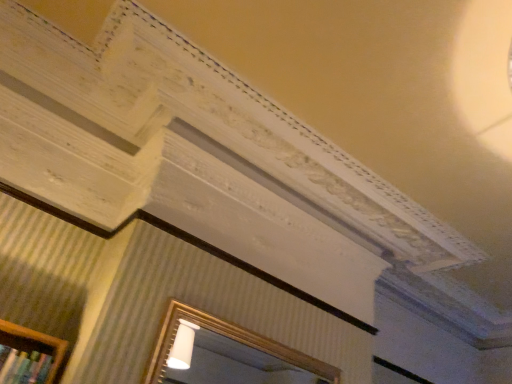
Locate an element on the screen. The image size is (512, 384). white glossy mirror at lower center is located at coordinates (226, 354).

Measure the distance between point (266,380) and camera.

The depth of point (266,380) is 4.34 meters.

Describe the element at coordinates (226, 354) in the screenshot. I see `white glossy mirror at lower center` at that location.

This screenshot has height=384, width=512. I want to click on white glossy mirror at lower center, so click(x=226, y=354).